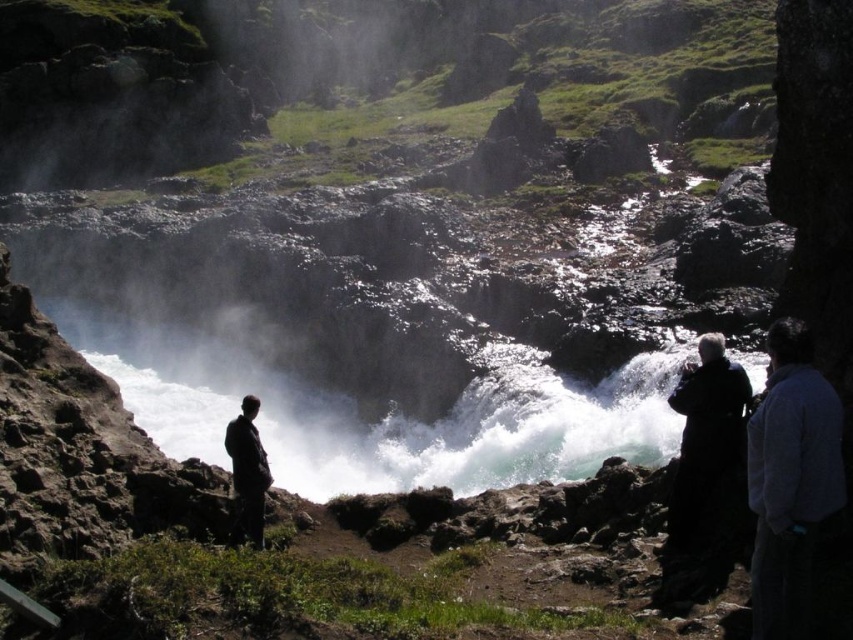
Question: Which point appears farthest from the camera in this image?

Choices:
 (A) (807, 605)
 (B) (262, 528)
 (C) (715, 563)

Answer: (B)

Question: Is dark blue fleece jacket at right bigger than dark gray suit at lower left?

Choices:
 (A) yes
 (B) no

Answer: (A)

Question: Which is farther from the black matte coat at right?

Choices:
 (A) dark gray suit at lower left
 (B) dark blue fleece jacket at right

Answer: (A)

Question: Is dark blue fleece jacket at right to the right of dark gray suit at lower left from the viewer's perspective?

Choices:
 (A) yes
 (B) no

Answer: (A)

Question: Which object is the closest to the dark blue fleece jacket at right?

Choices:
 (A) dark gray suit at lower left
 (B) black matte coat at right

Answer: (B)

Question: Is dark blue fleece jacket at right below dark gray suit at lower left?

Choices:
 (A) yes
 (B) no

Answer: (A)